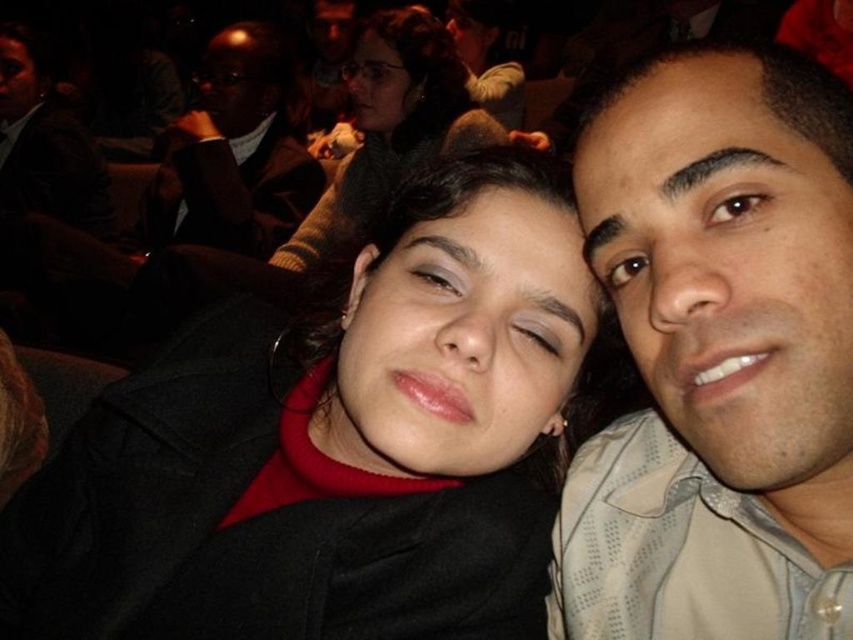
You are an event planner arranging seating for a photo opportunity. You need to place two markers at the coordinates point [56,589] and point [389,28]. Which marker should be placed closer to the camera to ensure both are visible in the photo?

Point [56,589] should be placed closer to the camera because it is in front of point [389,28], ensuring both markers are visible without one blocking the other.

You are a photographer trying to capture a close shot of the black matte jacket at center and the matte beige shirt at right. Since you want to focus on both, which one should you adjust your camera settings to prioritize in terms of width to ensure both are fully visible in the frame?

The black matte jacket at center is wider than the matte beige shirt at right, so you should prioritize adjusting your camera settings to accommodate the width of the black matte jacket at center to ensure both are fully visible.

In the scene shown: You are a photographer setting up for an event. You need to place a small light between the black matte jacket at center and the matte black hair at upper center to ensure both are well lit. Based on their positions, where should you place the light relative to these two objects?

The black matte jacket at center is positioned on the left side of matte black hair at upper center, so placing the light to the right of the black matte jacket at center and to the left of the matte black hair at upper center would ensure both are illuminated evenly.